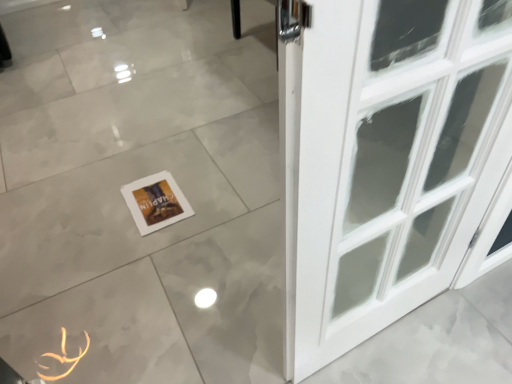
This screenshot has width=512, height=384. I want to click on vacant area that is in front of white paper at lower center, so click(x=163, y=254).